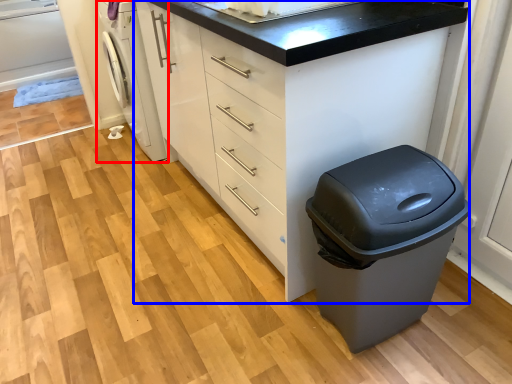
Question: Which object is closer to the camera taking this photo, washing machine (highlighted by a red box) or chest of drawers (highlighted by a blue box)?

Choices:
 (A) washing machine
 (B) chest of drawers

Answer: (B)